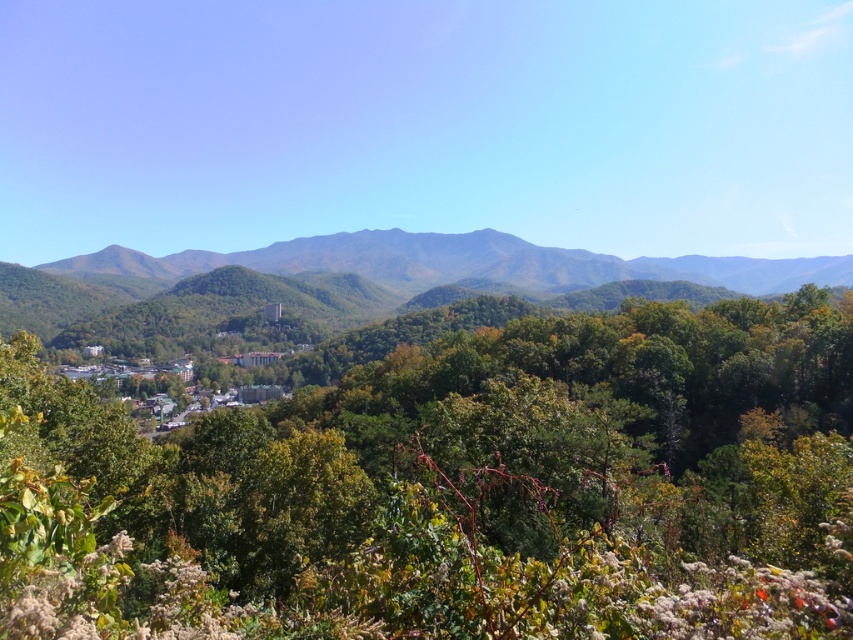
Question: Is green leafy tree at center thinner than green leafy forest at center?

Choices:
 (A) yes
 (B) no

Answer: (A)

Question: Does green leafy tree at center appear on the left side of green leafy forest at center?

Choices:
 (A) no
 (B) yes

Answer: (B)

Question: Is green leafy tree at center to the right of green leafy forest at center from the viewer's perspective?

Choices:
 (A) yes
 (B) no

Answer: (B)